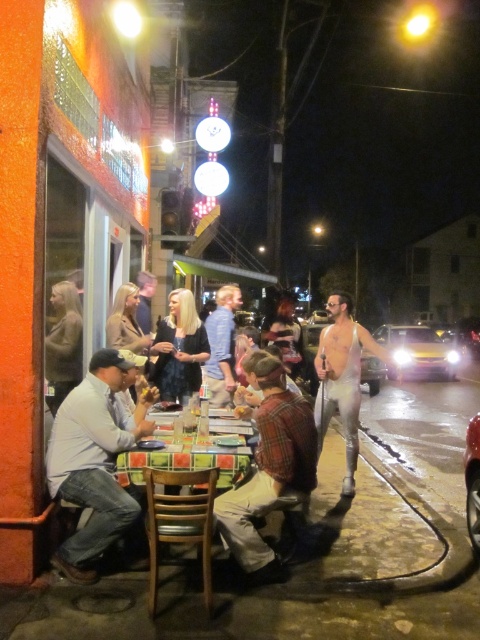
You are standing on the sidewalk outside the restaurant and want to take a photo of the plaid shirt at center. Where should you aim your camera to capture it?

You should aim your camera at point coordinates (269, 468) to capture the plaid shirt at center.